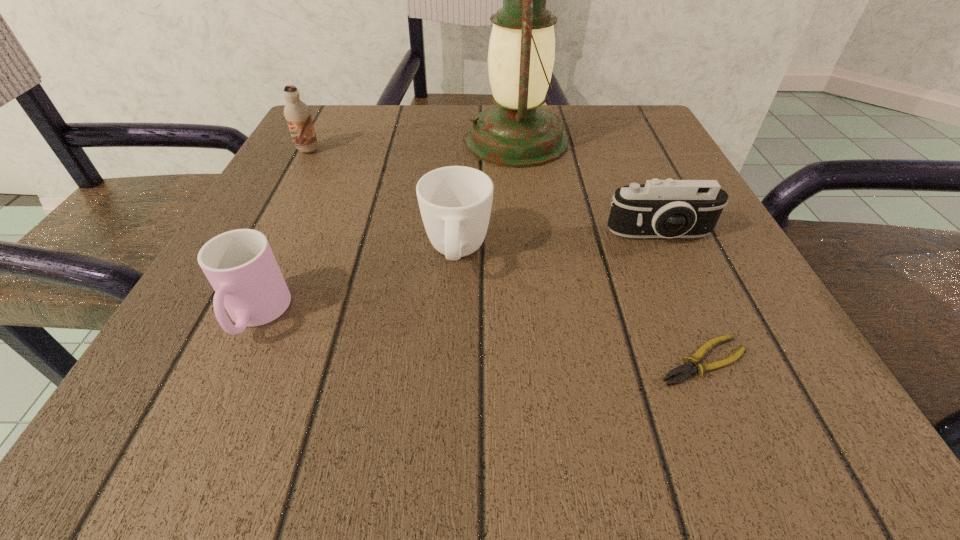
Locate an element on the screen. lantern is located at coordinates coord(517,133).

Locate an element on the screen. Image resolution: width=960 pixels, height=540 pixels. chocolate milk is located at coordinates (298, 115).

The width and height of the screenshot is (960, 540). What are the coordinates of `the right cup` in the screenshot? It's located at (455, 202).

I want to click on camera, so click(669, 208).

I want to click on the left cup, so click(240, 265).

Image resolution: width=960 pixels, height=540 pixels. I want to click on pliers, so click(x=686, y=370).

The image size is (960, 540). What are the coordinates of `vacant space located 0.140m with the light compartment facing forward on the lantern` in the screenshot? It's located at (394, 140).

Find the location of a particular element. vacant area located 0.080m with the light compartment facing forward on the lantern is located at coordinates (423, 140).

Image resolution: width=960 pixels, height=540 pixels. In order to click on vacant space positioned with the light compartment facing forward on the lantern in this screenshot , I will do `click(383, 140)`.

Where is `free space located 0.150m on the back of the fifth shortest object`? This screenshot has height=540, width=960. free space located 0.150m on the back of the fifth shortest object is located at coordinates (330, 111).